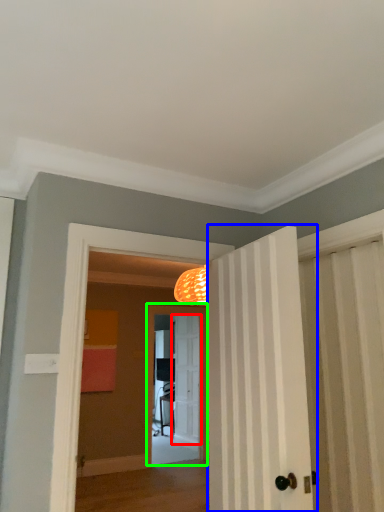
Question: Which object is the closest to the door (highlighted by a red box)? Choose among these: door (highlighted by a blue box) or screen door (highlighted by a green box).

Choices:
 (A) door
 (B) screen door

Answer: (B)